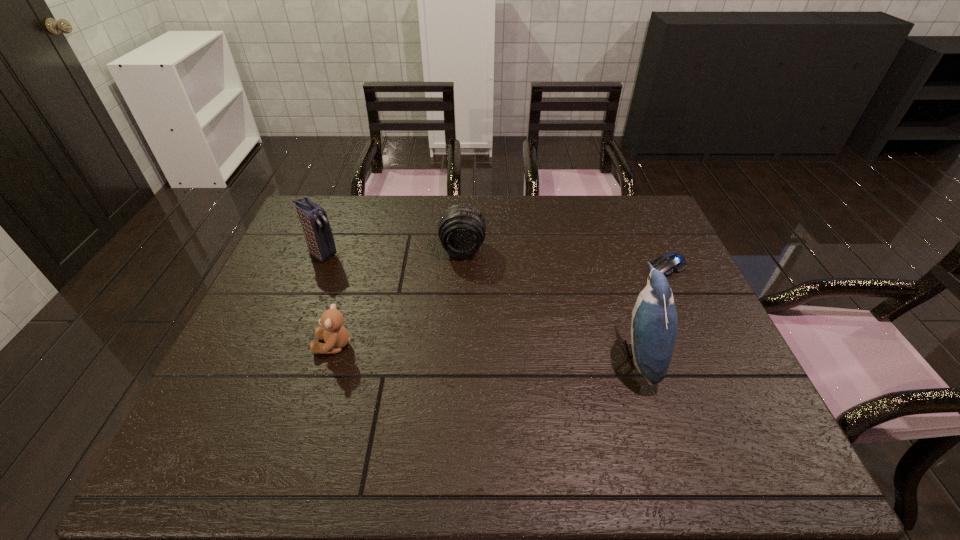
The image size is (960, 540). In order to click on vacant space located 0.180m on the front-facing side of the second object from left to right in this screenshot , I will do `click(244, 345)`.

Locate an element on the screen. The image size is (960, 540). vacant space located on the front-facing side of the second object from left to right is located at coordinates (264, 345).

The height and width of the screenshot is (540, 960). What are the coordinates of `vacant space situated at the tip of the bird's beak` in the screenshot? It's located at (500, 356).

This screenshot has width=960, height=540. I want to click on vacant space located 0.070m at the tip of the bird's beak, so click(591, 356).

Where is `blank space located 0.300m at the tip of the bird's beak`? This screenshot has height=540, width=960. blank space located 0.300m at the tip of the bird's beak is located at coordinates (496, 356).

I want to click on free spot located 0.330m on the button side of the rightmost object, so click(x=563, y=312).

You are a GUI agent. You are given a task and a screenshot of the screen. Output one action in this format:
    pyautogui.click(x=<x>, y=<y>)
    Task: Click on the free space located on the button side of the rightmost object
    
    Given the screenshot: What is the action you would take?
    pyautogui.click(x=581, y=304)

You are a GUI agent. You are given a task and a screenshot of the screen. Output one action in this format:
    pyautogui.click(x=<x>, y=<y>)
    Task: Click on the vacant position located 0.070m on the button side of the rightmost object
    
    Given the screenshot: What is the action you would take?
    pyautogui.click(x=636, y=280)

Where is `vacant region located 0.140m with the zip open on the second tallest object`? The height and width of the screenshot is (540, 960). vacant region located 0.140m with the zip open on the second tallest object is located at coordinates (364, 281).

This screenshot has width=960, height=540. What are the coordinates of `free space located with the zip open on the second tallest object` in the screenshot? It's located at (420, 319).